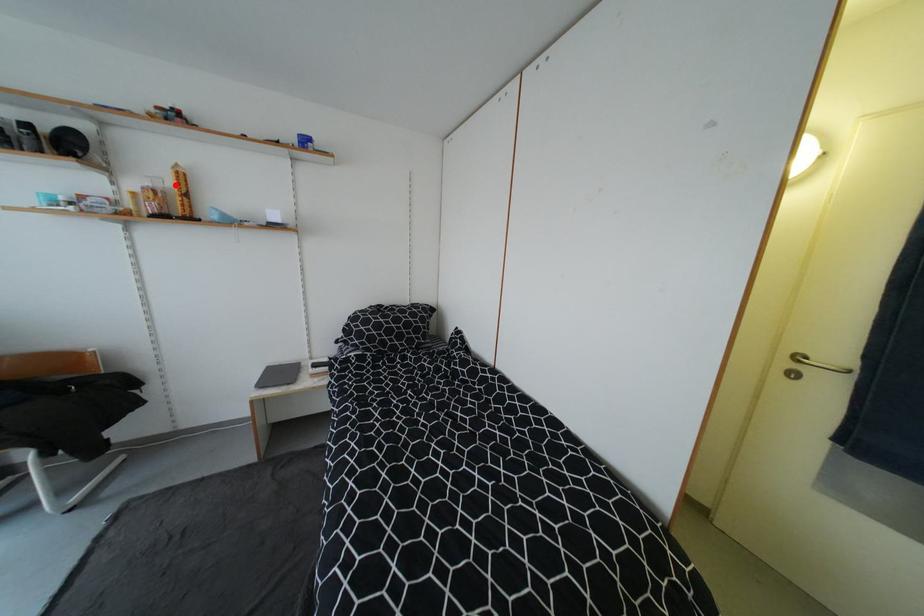
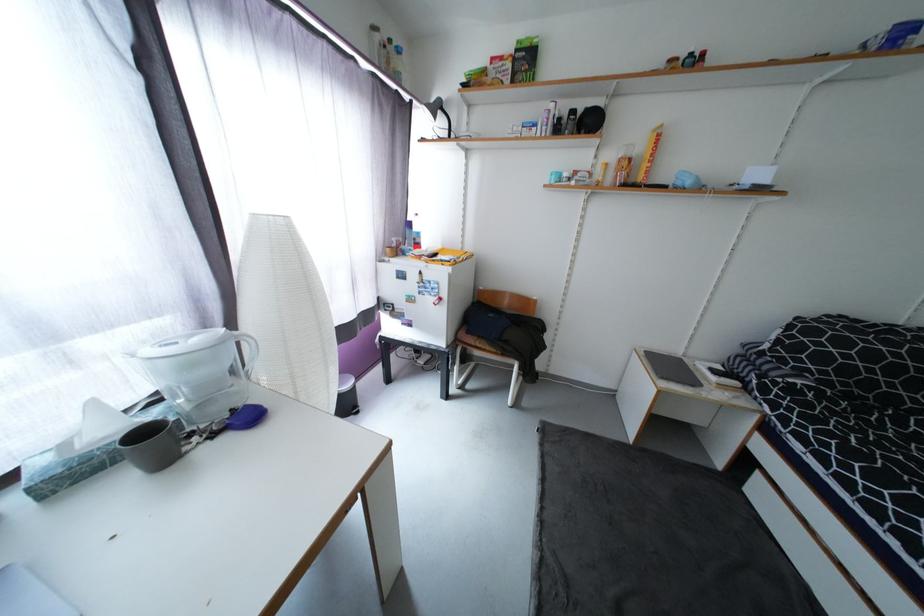
Question: I am providing you with two images of the same scene from different viewpoints. A red point is marked on the first image. At the location where the point appears in image 1, is it still visible in image 2?

Choices:
 (A) Yes
 (B) No

Answer: (A)